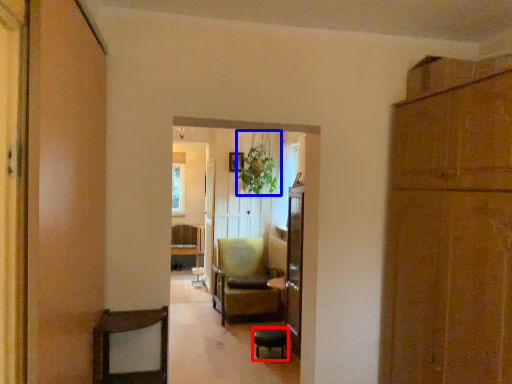
Question: Among these objects, which one is nearest to the camera, bar stool (highlighted by a red box) or plant (highlighted by a blue box)?

Choices:
 (A) bar stool
 (B) plant

Answer: (A)